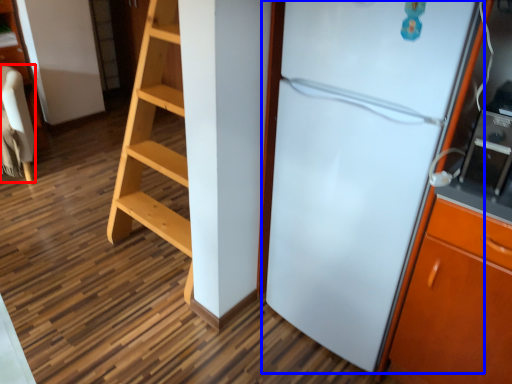
Question: Which of the following is the farthest to the observer, furniture (highlighted by a red box) or refrigerator (highlighted by a blue box)?

Choices:
 (A) furniture
 (B) refrigerator

Answer: (A)